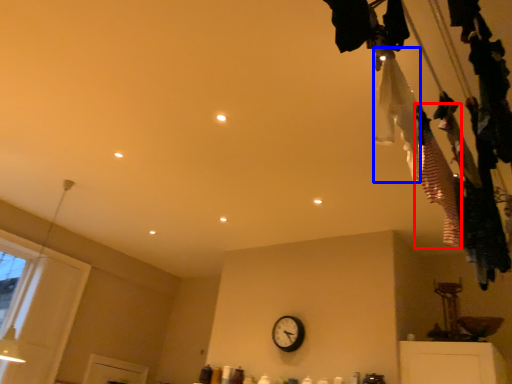
Question: Among these objects, which one is nearest to the camera, clothing (highlighted by a red box) or clothing (highlighted by a blue box)?

Choices:
 (A) clothing
 (B) clothing

Answer: (B)